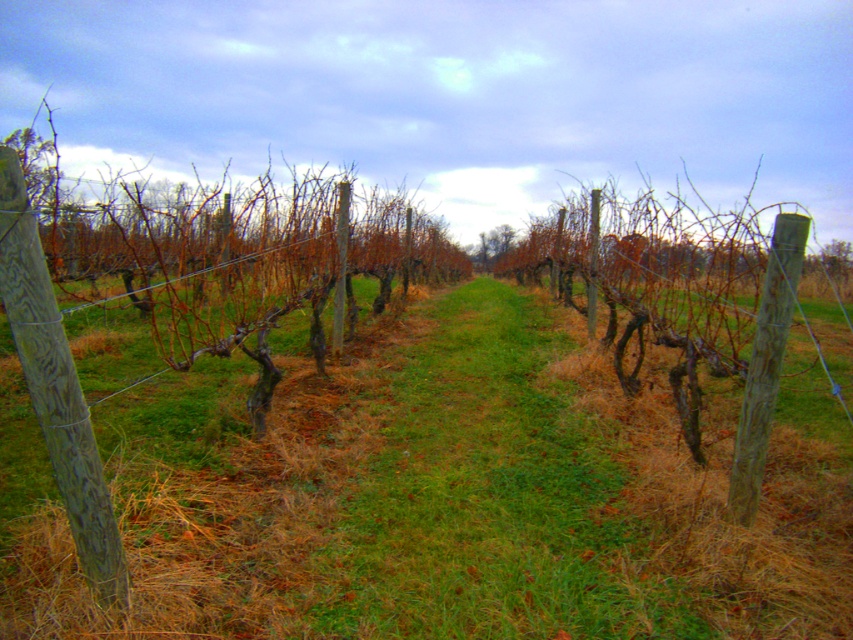
Which of these two, green grass at center or wooden post at left, stands taller?

wooden post at left is taller.

What do you see at coordinates (447, 499) in the screenshot? I see `green grass at center` at bounding box center [447, 499].

Between point (281, 518) and point (223, 572), which one is positioned behind?

Positioned behind is point (281, 518).

Find the location of a particular element. green grass at center is located at coordinates (447, 499).